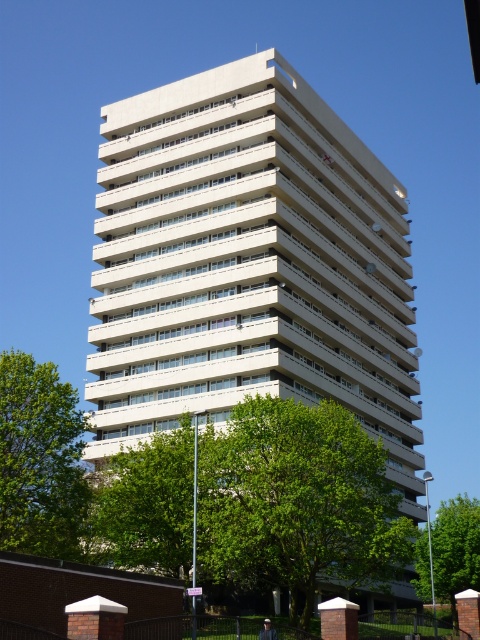
Question: Observing the image, what is the correct spatial positioning of green leafy tree at lower center in reference to green leafy tree at center?

Choices:
 (A) right
 (B) left

Answer: (B)

Question: Which object appears farthest from the camera in this image?

Choices:
 (A) green leafy tree at center
 (B) white smooth building at center

Answer: (B)

Question: Does green leafy tree at lower center appear under green leafy tree at lower left?

Choices:
 (A) no
 (B) yes

Answer: (B)

Question: Can you confirm if green leafy tree at lower center is wider than green leafy tree at center?

Choices:
 (A) no
 (B) yes

Answer: (A)

Question: Which point is farther to the camera?

Choices:
 (A) white smooth building at center
 (B) green leafy tree at lower center
 (C) green leafy tree at lower left
 (D) green leafy tree at center

Answer: (A)

Question: Which point appears closest to the camera in this image?

Choices:
 (A) (139, 188)
 (B) (462, 556)
 (C) (302, 436)

Answer: (C)